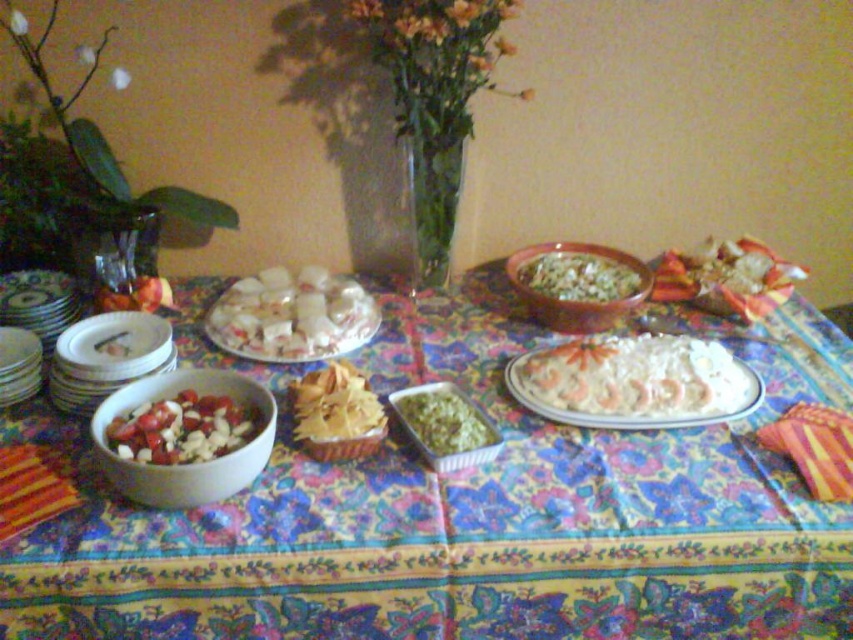
Question: Which point is closer to the camera?

Choices:
 (A) (222, 419)
 (B) (717, 291)
 (C) (639, 275)
 (D) (340, 406)

Answer: (A)

Question: Is crinkled paper bag at right smaller than shiny red tomato at center?

Choices:
 (A) yes
 (B) no

Answer: (B)

Question: Among these objects, which one is nearest to the camera?

Choices:
 (A) crinkled paper bag at right
 (B) green textured rice at center

Answer: (B)

Question: Which of the following is the farthest from the observer?

Choices:
 (A) pyautogui.click(x=219, y=412)
 (B) pyautogui.click(x=415, y=404)
 (C) pyautogui.click(x=798, y=449)
 (D) pyautogui.click(x=329, y=280)

Answer: (D)

Question: Is crinkled paper bag at right further to camera compared to green leafy salad at center?

Choices:
 (A) yes
 (B) no

Answer: (A)

Question: Can you confirm if green leafy salad at center is thinner than shiny red tomato at center?

Choices:
 (A) no
 (B) yes

Answer: (A)